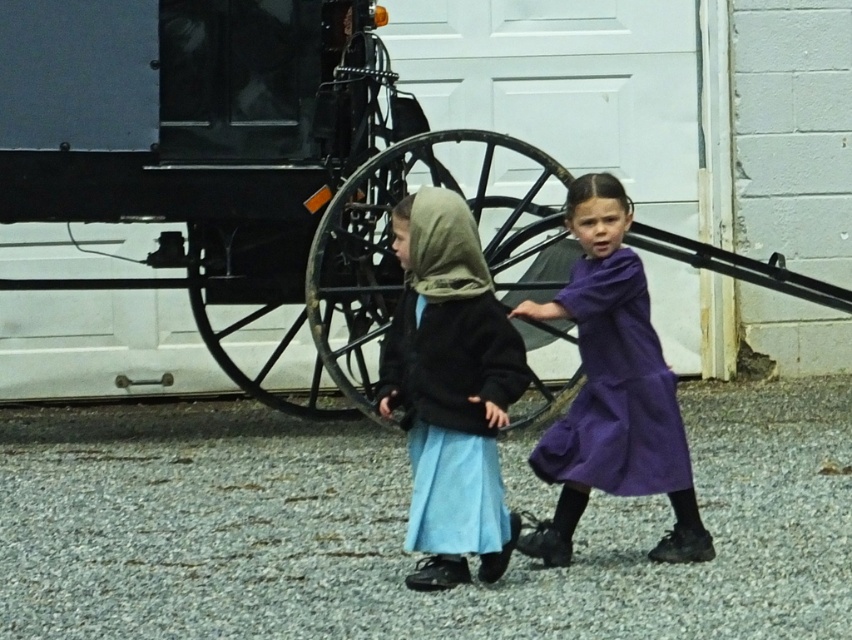
Can you confirm if black matte horse cart at center is smaller than purple matte dress at center?

Yes.

Does black matte horse cart at center have a lesser width compared to purple matte dress at center?

Yes.

Identify the location of black matte horse cart at center. Image resolution: width=852 pixels, height=640 pixels. (403, 179).

Which is more to the left, matte black jacket at center or purple matte dress at center?

matte black jacket at center is more to the left.

Is matte black jacket at center thinner than purple matte dress at center?

Yes.

Find the location of a particular element. matte black jacket at center is located at coordinates (450, 390).

Consider the image. Is black matte horse cart at center taller than matte black jacket at center?

In fact, black matte horse cart at center may be shorter than matte black jacket at center.

The width and height of the screenshot is (852, 640). What do you see at coordinates (403, 179) in the screenshot? I see `black matte horse cart at center` at bounding box center [403, 179].

Find the location of a particular element. Image resolution: width=852 pixels, height=640 pixels. black matte horse cart at center is located at coordinates (403, 179).